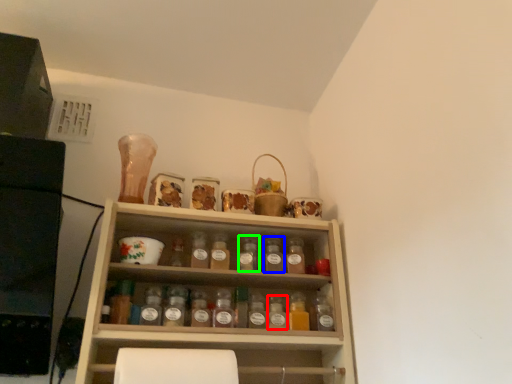
Question: Which object is the farthest from bottle (highlighted by a red box)? Choose among these: bottle (highlighted by a blue box) or bottle (highlighted by a green box).

Choices:
 (A) bottle
 (B) bottle

Answer: (B)